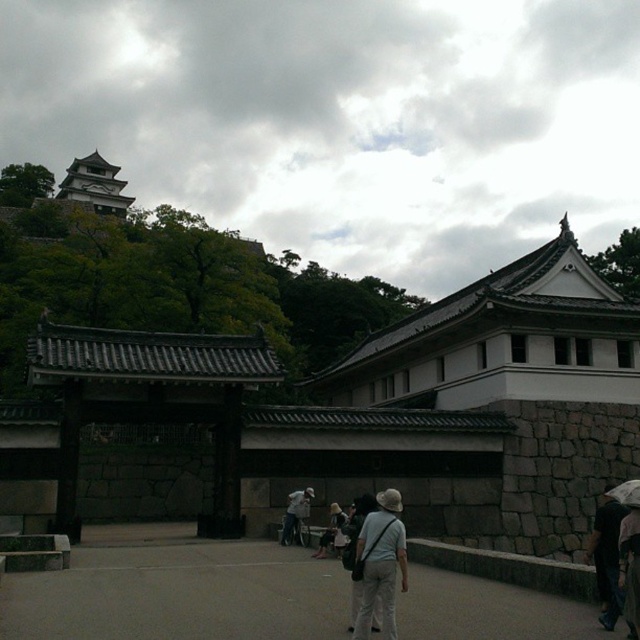
Question: Which point is farther from the camera taking this photo?

Choices:
 (A) (208, 465)
 (B) (376, 566)
 (C) (294, 515)

Answer: (A)

Question: Among these objects, which one is farthest from the camera?

Choices:
 (A) dark brown leather backpack at lower right
 (B) dark gray fabric hat at lower right

Answer: (A)

Question: Which of the following is the closest to the observer?

Choices:
 (A) (593, 522)
 (B) (298, 528)
 (C) (84, 404)
 (D) (108, 196)

Answer: (C)

Question: In this image, where is dark gray fabric hat at lower right located relative to white fabric bag at center?

Choices:
 (A) right
 (B) left

Answer: (A)

Question: Is light beige cotton hat at center wider than transparent plastic umbrella at lower right?

Choices:
 (A) yes
 (B) no

Answer: (B)

Question: Does dark gray fabric hat at lower right appear under transparent plastic umbrella at lower right?

Choices:
 (A) no
 (B) yes

Answer: (A)